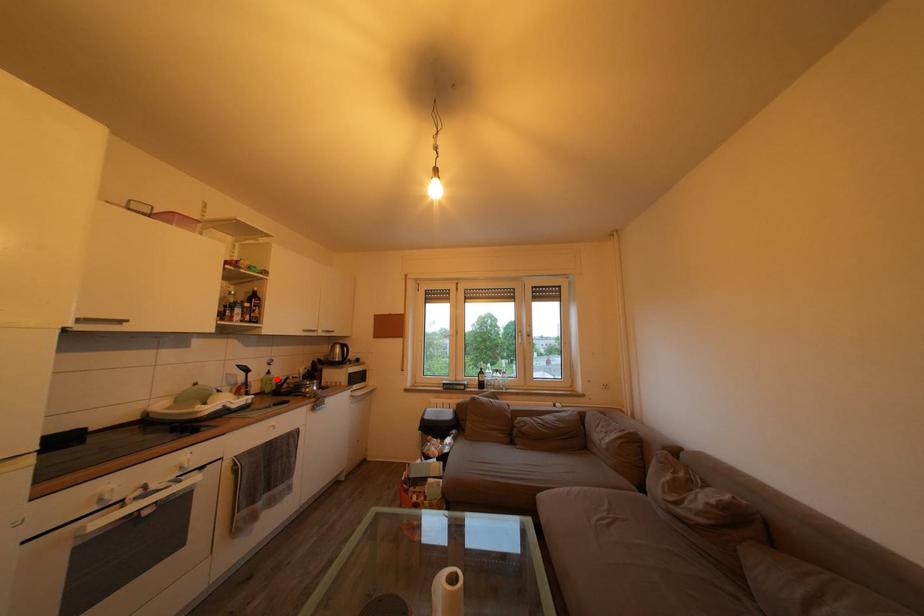
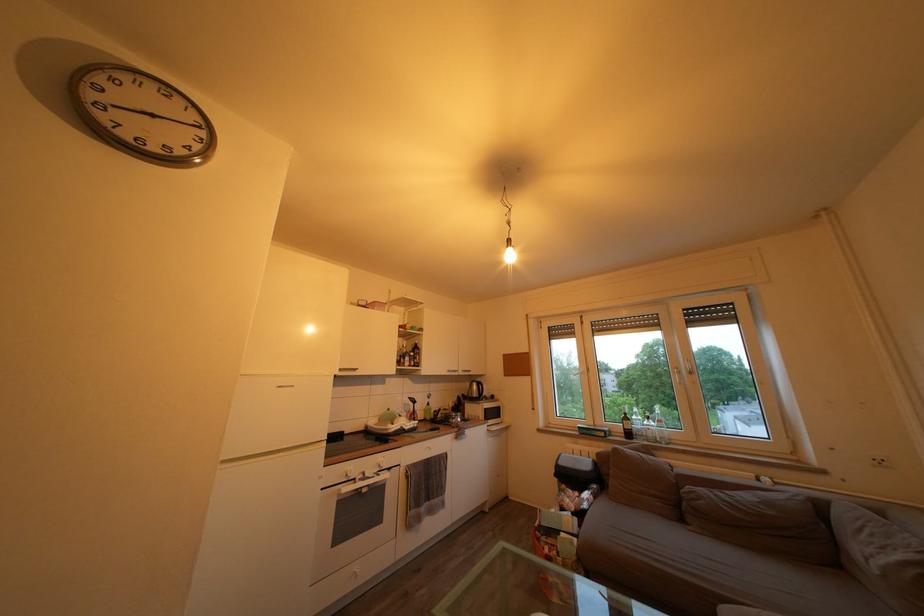
In the second image, find the point that corresponds to the highlighted location in the first image.

(436, 411)